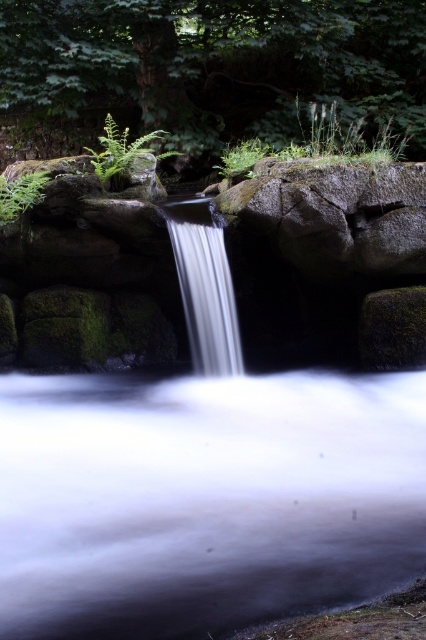
Measure the distance between green matte fern at upper left and camera.

A distance of 23.50 feet exists between green matte fern at upper left and camera.

Is green matte fern at upper left to the left of green fuzzy fern at upper center from the viewer's perspective?

Yes, green matte fern at upper left is to the left of green fuzzy fern at upper center.

Describe the element at coordinates (118, 150) in the screenshot. The image size is (426, 640). I see `green matte fern at upper left` at that location.

You are a GUI agent. You are given a task and a screenshot of the screen. Output one action in this format:
    pyautogui.click(x=<x>, y=<y>)
    Task: Click on the green matte fern at upper left
    
    Given the screenshot: What is the action you would take?
    pyautogui.click(x=118, y=150)

Is gray rough rock at center thinner than green fuzzy fern at upper left?

No.

Which is more to the right, gray rough rock at center or green fuzzy fern at upper left?

From the viewer's perspective, gray rough rock at center appears more on the right side.

Locate an element on the screen. Image resolution: width=426 pixels, height=640 pixels. gray rough rock at center is located at coordinates (336, 214).

The width and height of the screenshot is (426, 640). I want to click on gray rough rock at center, so click(336, 214).

The height and width of the screenshot is (640, 426). I want to click on white smooth waterfall at center, so click(204, 288).

Which of these two, white smooth waterfall at center or green fuzzy fern at upper center, stands shorter?

green fuzzy fern at upper center

What do you see at coordinates (204, 288) in the screenshot? I see `white smooth waterfall at center` at bounding box center [204, 288].

This screenshot has height=640, width=426. I want to click on white smooth waterfall at center, so click(x=204, y=288).